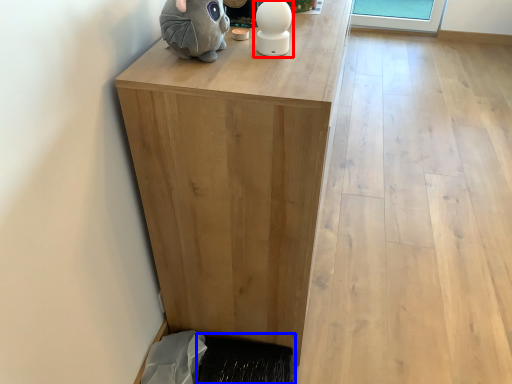
Question: Which point is closer to the camera, figurine (highlighted by a red box) or doormat (highlighted by a blue box)?

Choices:
 (A) figurine
 (B) doormat

Answer: (A)